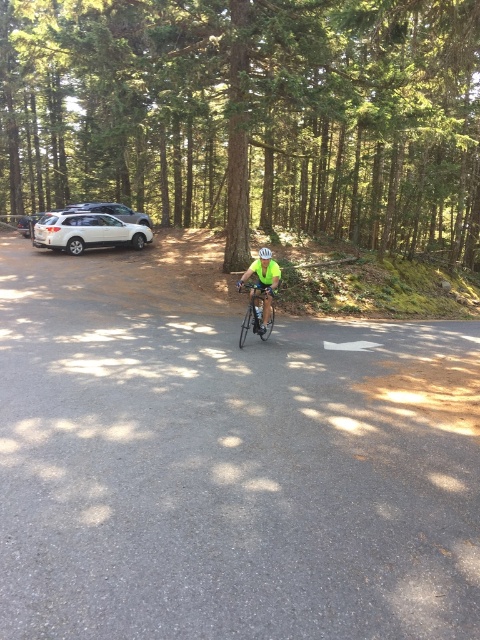
You are a hiker standing on the paved road in the forest scene. You see the green textured tree at center marked by point (x=251, y=115). If you walk straight ahead along the road, will you get closer to the tree?

The green textured tree at center is represented by point (x=251, y=115). Walking straight ahead along the road would not bring you closer to the tree since the road leads towards the camera and the tree is positioned at the center of the scene, likely perpendicular to the road direction.

You are standing at the point with coordinates point (x=262, y=253) and want to walk to the point with coordinates point (x=242, y=332). Which direction should you move relative to the cyclist?

You should move in the direction towards the cyclist because point (x=242, y=332) is in front of point (x=262, y=253), meaning it is closer to the cyclist who is facing towards the camera.